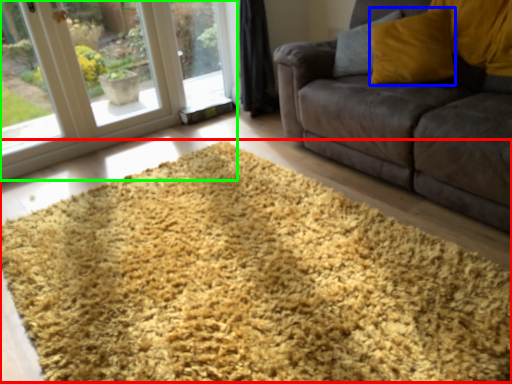
Question: Which object is the farthest from hay (highlighted by a red box)? Choose among these: throw pillow (highlighted by a blue box) or window (highlighted by a green box).

Choices:
 (A) throw pillow
 (B) window

Answer: (B)